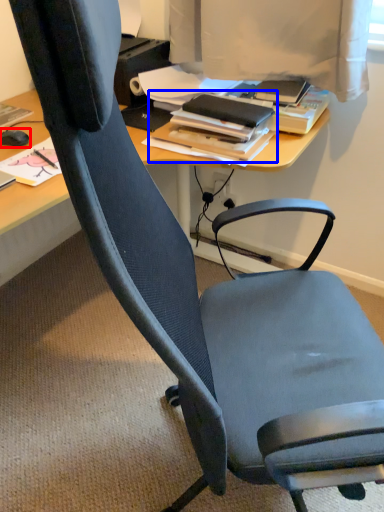
Question: Which point is further to the camera, mouse (highlighted by a red box) or book (highlighted by a blue box)?

Choices:
 (A) mouse
 (B) book

Answer: (A)